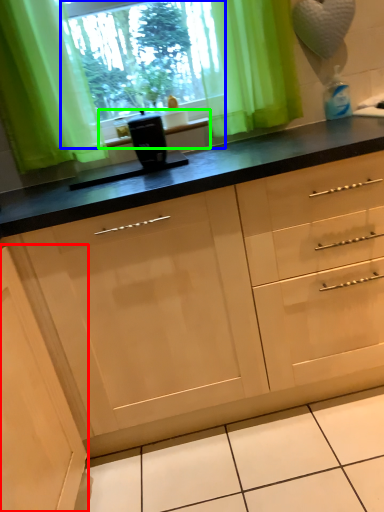
Question: Estimate the real-world distances between objects in this image. Which object is farther from cabinetry (highlighted by a red box), window screen (highlighted by a blue box) or window sill (highlighted by a green box)?

Choices:
 (A) window screen
 (B) window sill

Answer: (A)